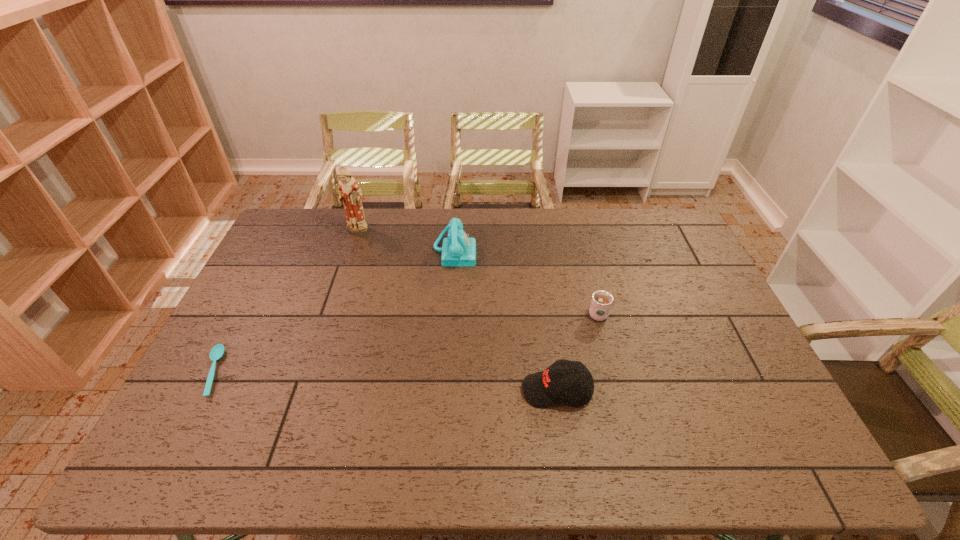
Where is `object positioned at the left edge`? The width and height of the screenshot is (960, 540). object positioned at the left edge is located at coordinates (216, 353).

At what (x,y) coordinates should I click in order to perform the action: click on free space at the far edge of the desktop. Please return your answer as a coordinate pair (x, y). Looking at the image, I should click on (374, 229).

Identify the location of vacant space at the near edge of the desktop. This screenshot has height=540, width=960. (389, 436).

This screenshot has width=960, height=540. In the image, there is a desktop. Find the location of `vacant region at the left edge`. vacant region at the left edge is located at coordinates (268, 252).

Locate an element on the screen. The height and width of the screenshot is (540, 960). free space at the right edge of the desktop is located at coordinates (687, 303).

Where is `vacant space at the far left corner`? The image size is (960, 540). vacant space at the far left corner is located at coordinates (296, 220).

Locate an element on the screen. The height and width of the screenshot is (540, 960). free space between the baseball cap and the shortest object is located at coordinates (385, 381).

Image resolution: width=960 pixels, height=540 pixels. In order to click on free point between the leftmost object and the second object from right to left in this screenshot , I will do `click(385, 381)`.

At what (x,y) coordinates should I click in order to perform the action: click on vacant area between the fourth object from right to left and the telephone. Please return your answer as a coordinate pair (x, y). The height and width of the screenshot is (540, 960). Looking at the image, I should click on (406, 242).

You are a GUI agent. You are given a task and a screenshot of the screen. Output one action in this format:
    pyautogui.click(x=<x>, y=<y>)
    Task: Click on the free space between the rightmost object and the third object from left to right
    The height and width of the screenshot is (540, 960).
    Given the screenshot: What is the action you would take?
    pyautogui.click(x=526, y=282)